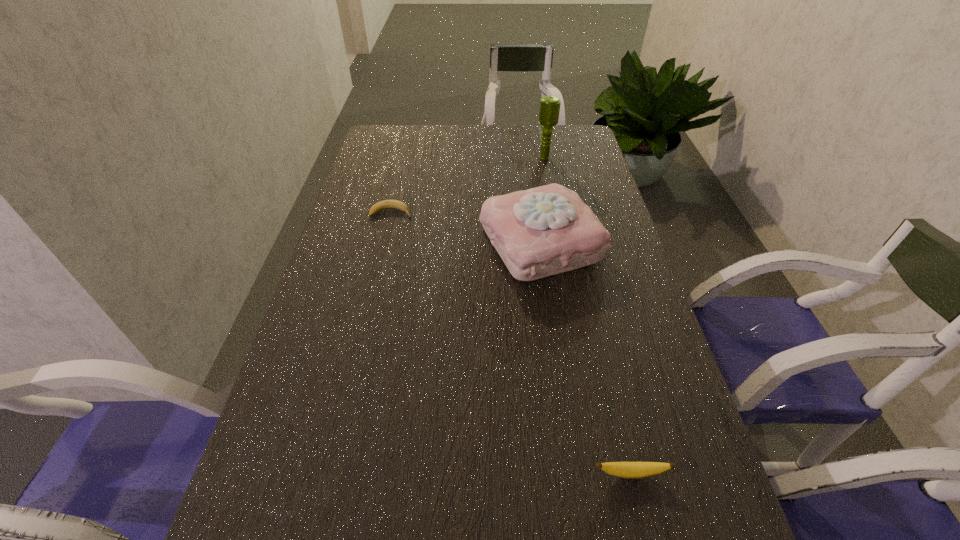
Where is `object that is the second closest to the microphone`? object that is the second closest to the microphone is located at coordinates (386, 204).

Find the location of a particular element. The width and height of the screenshot is (960, 540). object that stands as the second closest to the cake is located at coordinates (549, 110).

The image size is (960, 540). I want to click on blank area in the image that satisfies the following two spatial constraints: 1. on the back side of the nearest object; 2. at the stem of the left banana, so click(569, 213).

You are a GUI agent. You are given a task and a screenshot of the screen. Output one action in this format:
    pyautogui.click(x=<x>, y=<y>)
    Task: Click on the free spot that satisfies the following two spatial constraints: 1. on the front side of the farthest object; 2. on the right side of the second shortest object
    
    Given the screenshot: What is the action you would take?
    pyautogui.click(x=607, y=474)

Find the location of a particular element. Image resolution: width=960 pixels, height=540 pixels. vacant space that satisfies the following two spatial constraints: 1. on the back side of the taller banana; 2. at the stem of the leftmost object is located at coordinates (569, 213).

This screenshot has width=960, height=540. I want to click on free region that satisfies the following two spatial constraints: 1. on the back side of the second tallest object; 2. at the stem of the shorter banana, so click(537, 213).